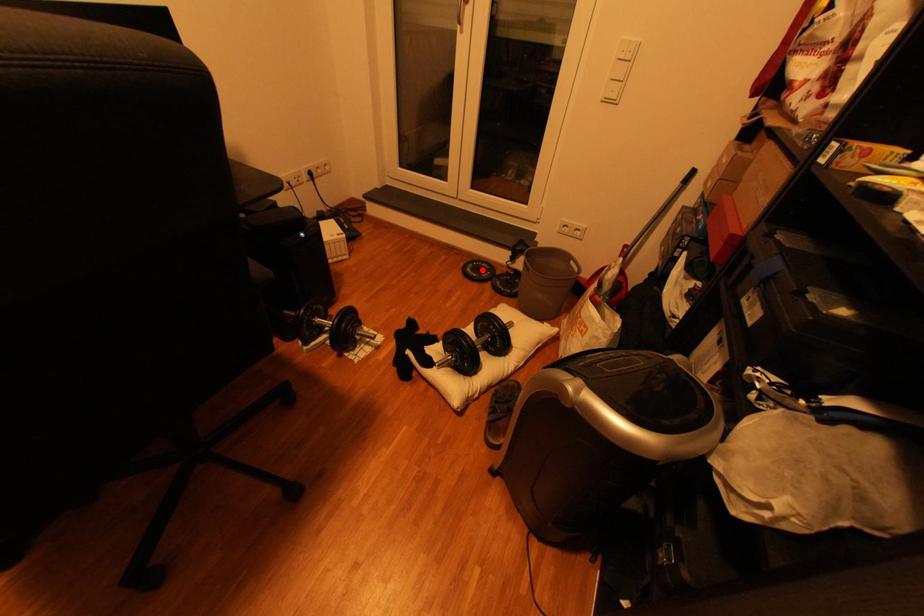
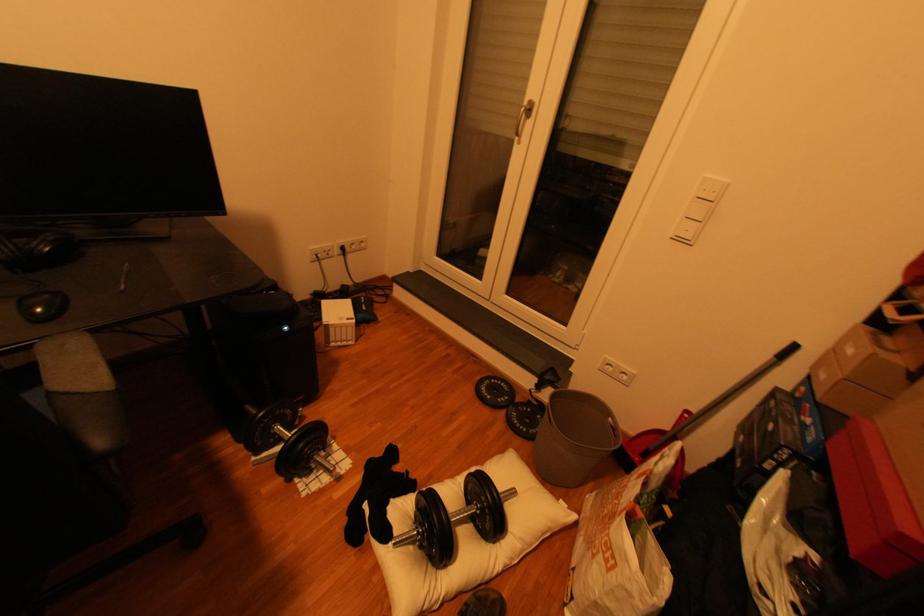
The point at the highlighted location is marked in the first image. Where is the corresponding point in the second image?

(497, 389)